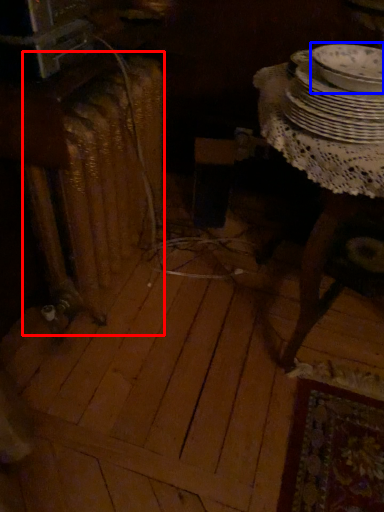
Question: Which of the following is the closest to the observer, radiator (highlighted by a red box) or tableware (highlighted by a blue box)?

Choices:
 (A) radiator
 (B) tableware

Answer: (B)